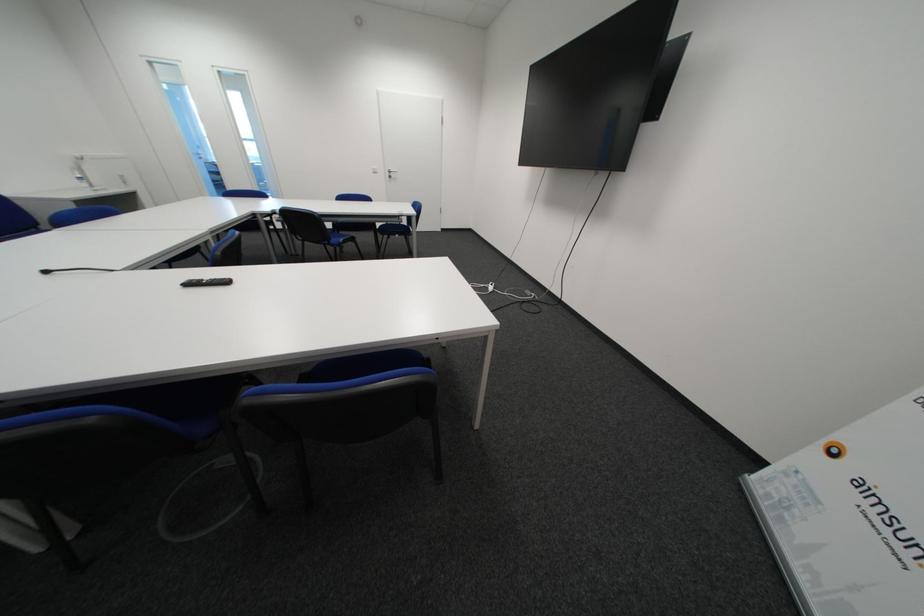
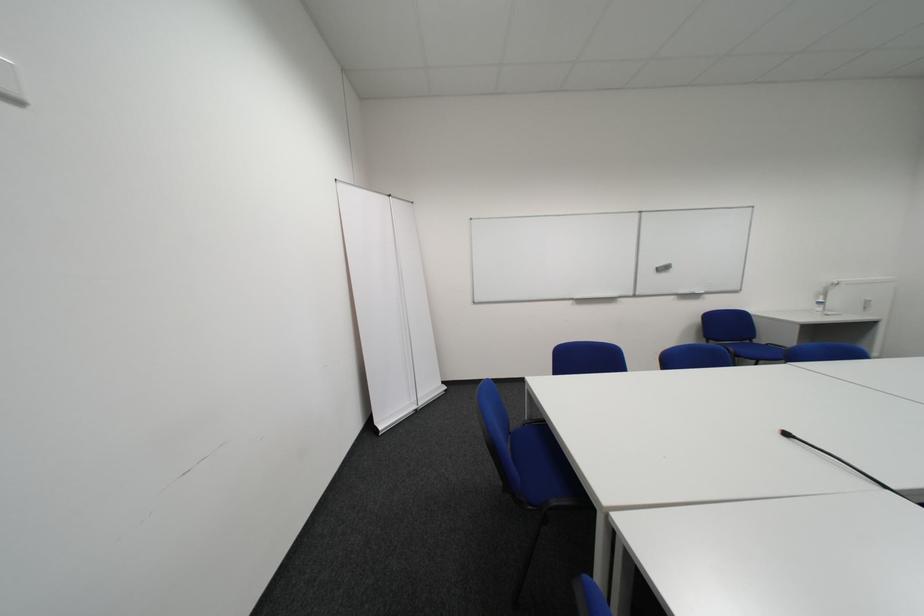
Question: The first image is from the beginning of the video and the second image is from the end. How did the camera likely rotate when shooting the video?

Choices:
 (A) Left
 (B) Right
 (C) Up
 (D) Down

Answer: (A)